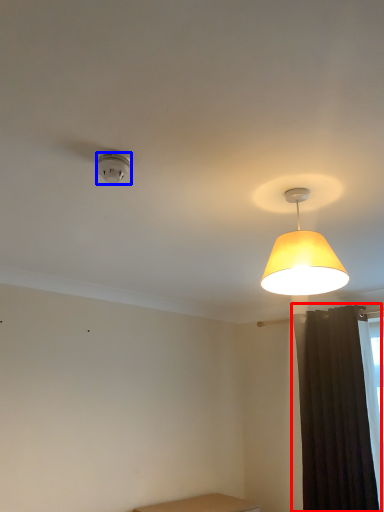
Question: Among these objects, which one is nearest to the camera, curtain (highlighted by a red box) or lamp (highlighted by a blue box)?

Choices:
 (A) curtain
 (B) lamp

Answer: (B)